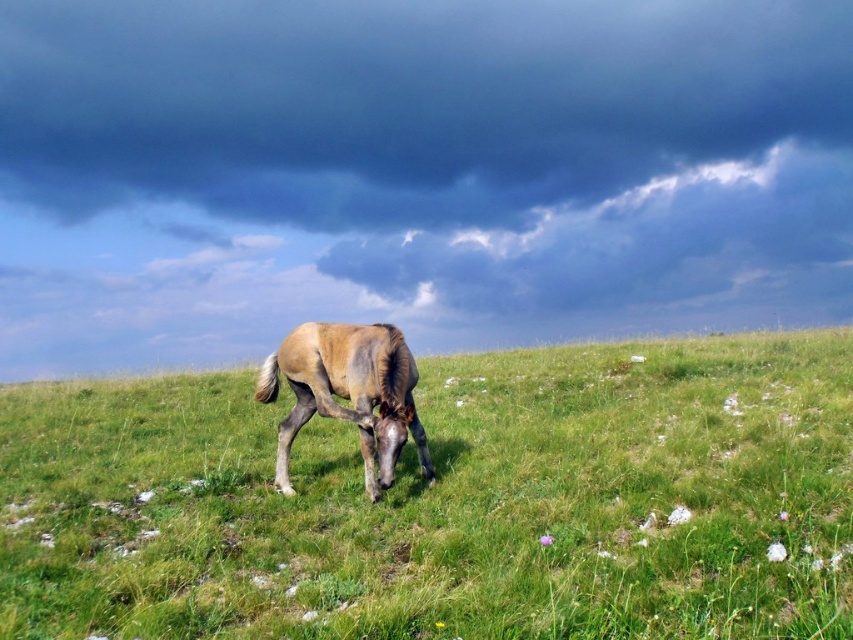
You are a photographer standing in the meadow and want to capture a photo where the green grassy at center is clearly visible in front of the brown textured horse at center. Is this possible based on the scene?

Yes, because the green grassy at center is in front of the brown textured horse at center, so the grass will naturally appear in front of the horse in the photo.

You are standing in the meadow and see the green grassy at center and the brown textured horse at center. Which object is located to the right of the other?

The green grassy at center is to the right of the brown textured horse at center.